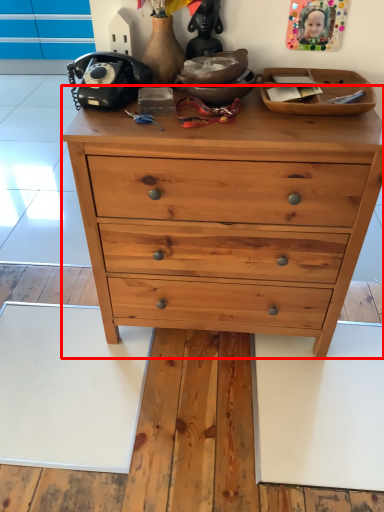
Question: Considering the relative positions of chest of drawers (annotated by the red box) and toy in the image provided, where is chest of drawers (annotated by the red box) located with respect to the staircase?

Choices:
 (A) right
 (B) left

Answer: (A)